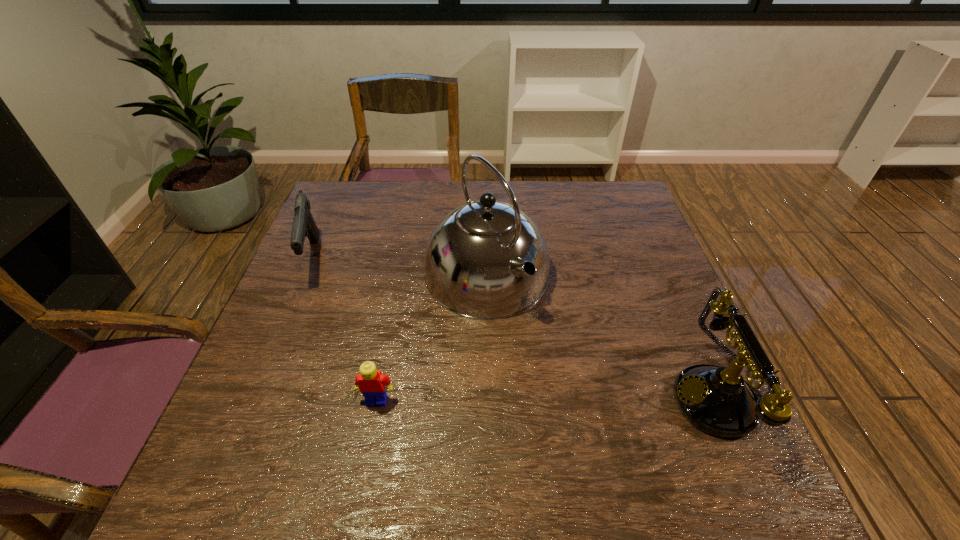
Locate an element on the screen. The width and height of the screenshot is (960, 540). object that is the third closest to the shortest object is located at coordinates (717, 400).

At what (x,y) coordinates should I click in order to perform the action: click on object that stands as the third closest to the tallest object. Please return your answer as a coordinate pair (x, y). Image resolution: width=960 pixels, height=540 pixels. Looking at the image, I should click on (304, 225).

Where is `free space that satisfies the following two spatial constraints: 1. on the front side of the rightmost object; 2. on the dial of the kettle`? Image resolution: width=960 pixels, height=540 pixels. free space that satisfies the following two spatial constraints: 1. on the front side of the rightmost object; 2. on the dial of the kettle is located at coordinates (489, 398).